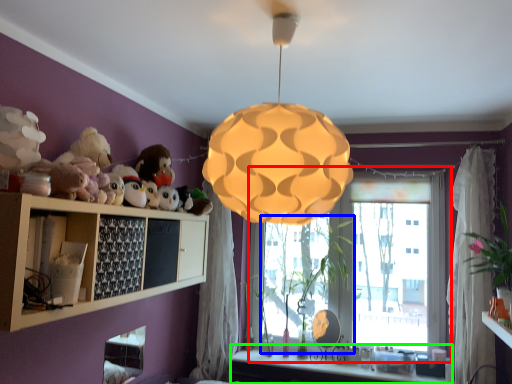
Question: Which is nearer to the window (highlighted by a red box)? plant (highlighted by a blue box) or vanity (highlighted by a green box).

Choices:
 (A) plant
 (B) vanity

Answer: (A)